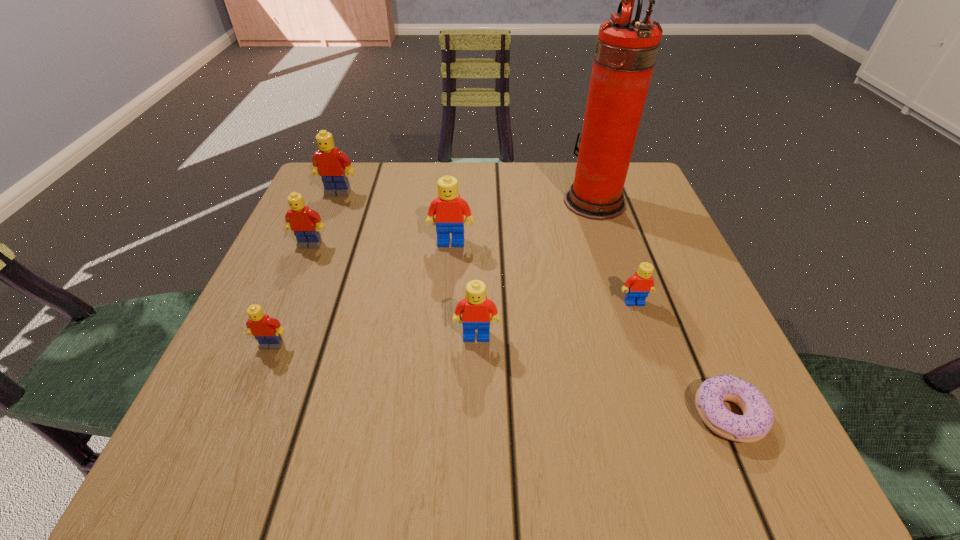
In the image, there is a desktop. At what (x,y) coordinates should I click in order to perform the action: click on vacant space at the far edge. Please return your answer as a coordinate pair (x, y). Image resolution: width=960 pixels, height=540 pixels. Looking at the image, I should click on (573, 171).

Where is `vacant space at the near edge of the desktop`? This screenshot has width=960, height=540. vacant space at the near edge of the desktop is located at coordinates (608, 426).

In the image, there is a desktop. At what (x,y) coordinates should I click in order to perform the action: click on vacant region at the left edge. Please return your answer as a coordinate pair (x, y). The width and height of the screenshot is (960, 540). Looking at the image, I should click on (234, 338).

Find the location of `free space at the right edge`. free space at the right edge is located at coordinates (675, 294).

Image resolution: width=960 pixels, height=540 pixels. In order to click on vacant space at the far left corner of the desktop in this screenshot , I will do `click(372, 209)`.

What are the coordinates of `vacant space at the far right corner of the desktop` in the screenshot? It's located at (658, 205).

You are a GUI agent. You are given a task and a screenshot of the screen. Output one action in this format:
    pyautogui.click(x=<x>, y=<y>)
    Task: Click on the free space between the fire extinguisher and the nearest red Lego
    This screenshot has width=960, height=540.
    Given the screenshot: What is the action you would take?
    pyautogui.click(x=536, y=269)

You are a GUI agent. You are given a task and a screenshot of the screen. Output one action in this format:
    pyautogui.click(x=<x>, y=<y>)
    Task: Click on the free area in between the second farthest yellow Lego and the biggest yellow Lego
    This screenshot has height=540, width=960.
    Given the screenshot: What is the action you would take?
    pyautogui.click(x=324, y=219)

Where is `free space between the purple doughnut and the tallest object`? This screenshot has width=960, height=540. free space between the purple doughnut and the tallest object is located at coordinates coord(661,308).

I want to click on vacant point located between the rightmost red Lego and the purple doughnut, so click(682, 359).